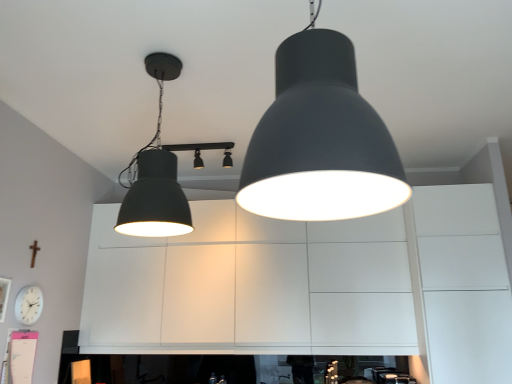
Question: From the image's perspective, is white matte clock at lower left located above or below matte black lampshade at center, the 3th lamp in the back-to-front sequence?

Choices:
 (A) above
 (B) below

Answer: (B)

Question: Do you think white matte clock at lower left is within matte black lampshade at center, the 3th lamp in the back-to-front sequence, or outside of it?

Choices:
 (A) inside
 (B) outside

Answer: (B)

Question: Based on their relative distances, which object is nearer to the matte black lampshade at center, the 1th lamp from the front?

Choices:
 (A) matte black spotlights at center, acting as the 3th lamp starting from the front
 (B) matte black lampshade at upper left, which is counted as the second lamp, starting from the back
 (C) white matte clock at lower left

Answer: (B)

Question: Which object is the closest to the matte black spotlights at center, marked as the first lamp in a back-to-front arrangement?

Choices:
 (A) matte black lampshade at center, the 3th lamp in the back-to-front sequence
 (B) white matte clock at lower left
 (C) matte black lampshade at upper left, which is counted as the second lamp, starting from the back

Answer: (C)